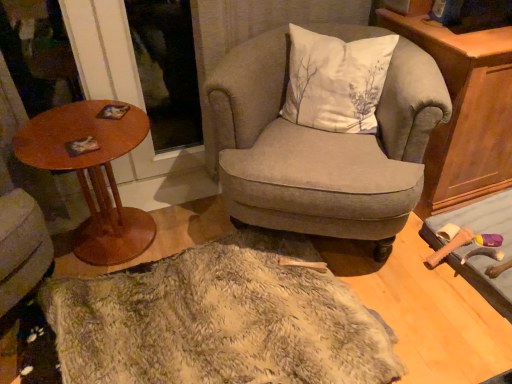
Question: Considering the relative sizes of white cotton cushion at center and wooden cabinet at right in the image provided, is white cotton cushion at center taller than wooden cabinet at right?

Choices:
 (A) no
 (B) yes

Answer: (A)

Question: Is white cotton cushion at center completely or partially outside of wooden cabinet at right?

Choices:
 (A) yes
 (B) no

Answer: (A)

Question: Is white cotton cushion at center behind wooden cabinet at right?

Choices:
 (A) no
 (B) yes

Answer: (A)

Question: Is white cotton cushion at center at the right side of wooden cabinet at right?

Choices:
 (A) no
 (B) yes

Answer: (A)

Question: From the image's perspective, is white cotton cushion at center located above wooden cabinet at right?

Choices:
 (A) yes
 (B) no

Answer: (A)

Question: Is fuzzy beige rug at center taller or shorter than wooden cabinet at right?

Choices:
 (A) tall
 (B) short

Answer: (B)

Question: In the image, is fuzzy beige rug at center positioned in front of or behind wooden cabinet at right?

Choices:
 (A) behind
 (B) front

Answer: (B)

Question: Do you think fuzzy beige rug at center is within wooden cabinet at right, or outside of it?

Choices:
 (A) inside
 (B) outside

Answer: (B)

Question: From a real-world perspective, is fuzzy beige rug at center above or below wooden cabinet at right?

Choices:
 (A) above
 (B) below

Answer: (B)

Question: Considering the positions of point (324, 64) and point (99, 104), is point (324, 64) closer or farther from the camera than point (99, 104)?

Choices:
 (A) farther
 (B) closer

Answer: (B)

Question: Would you say white cotton cushion at center is to the left or to the right of wooden round table at left in the picture?

Choices:
 (A) left
 (B) right

Answer: (B)

Question: From a real-world perspective, relative to wooden round table at left, is white cotton cushion at center vertically above or below?

Choices:
 (A) below
 (B) above

Answer: (B)

Question: From their relative heights in the image, would you say white cotton cushion at center is taller or shorter than wooden round table at left?

Choices:
 (A) short
 (B) tall

Answer: (A)

Question: Considering the positions of wooden round table at left and textured gray armchair at center in the image, is wooden round table at left taller or shorter than textured gray armchair at center?

Choices:
 (A) short
 (B) tall

Answer: (A)

Question: From a real-world perspective, is wooden round table at left positioned above or below textured gray armchair at center?

Choices:
 (A) above
 (B) below

Answer: (B)